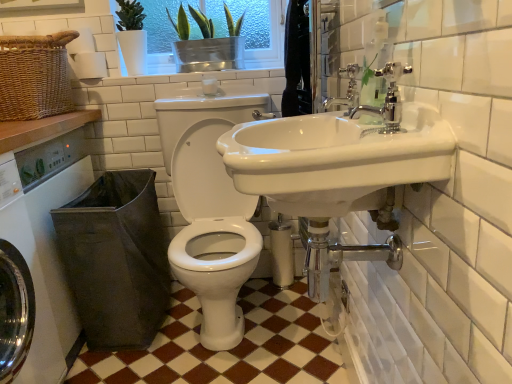
Question: Is chrome metallic faucet at upper right, the 1th tap when ordered from back to front, at the left side of polished chrome faucet at upper right, which is the second tap in back-to-front order?

Choices:
 (A) no
 (B) yes

Answer: (A)

Question: Is chrome metallic faucet at upper right, the 1th tap when ordered from back to front, not within polished chrome faucet at upper right, which is the second tap in back-to-front order?

Choices:
 (A) yes
 (B) no

Answer: (A)

Question: Considering the relative sizes of chrome metallic faucet at upper right, the 1th tap when ordered from back to front, and polished chrome faucet at upper right, the first tap when ordered from front to back, in the image provided, is chrome metallic faucet at upper right, the 1th tap when ordered from back to front, wider than polished chrome faucet at upper right, the first tap when ordered from front to back,?

Choices:
 (A) yes
 (B) no

Answer: (B)

Question: From a real-world perspective, is chrome metallic faucet at upper right, the 1th tap when ordered from back to front, over polished chrome faucet at upper right, which is the second tap in back-to-front order?

Choices:
 (A) no
 (B) yes

Answer: (B)

Question: From the image's perspective, is chrome metallic faucet at upper right, the 1th tap when ordered from back to front, below polished chrome faucet at upper right, which is the second tap in back-to-front order?

Choices:
 (A) no
 (B) yes

Answer: (A)

Question: Is polished chrome faucet at upper right, the first tap when ordered from front to back, a part of chrome metallic faucet at upper right, the 1th tap when ordered from back to front?

Choices:
 (A) no
 (B) yes

Answer: (A)

Question: Is white glossy sink at center thinner than white tile at upper center?

Choices:
 (A) no
 (B) yes

Answer: (A)

Question: Does white glossy sink at center contain white tile at upper center?

Choices:
 (A) no
 (B) yes

Answer: (A)

Question: Is white glossy sink at center not near white tile at upper center?

Choices:
 (A) yes
 (B) no

Answer: (A)

Question: From the image's perspective, would you say white glossy sink at center is positioned over white tile at upper center?

Choices:
 (A) no
 (B) yes

Answer: (A)

Question: Is white glossy sink at center shorter than white tile at upper center?

Choices:
 (A) no
 (B) yes

Answer: (A)

Question: Is white glossy sink at center further to camera compared to white tile at upper center?

Choices:
 (A) no
 (B) yes

Answer: (A)

Question: Is chrome metallic faucet at upper right, the 1th tap when ordered from back to front, a part of white glossy sink at center?

Choices:
 (A) yes
 (B) no

Answer: (A)